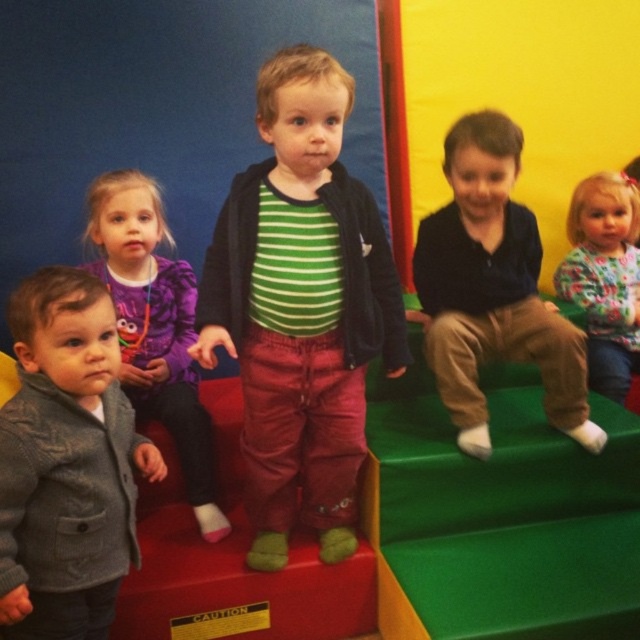
Question: Considering the real-world distances, which object is closest to the floral fabric dress at upper right?

Choices:
 (A) dark blue shirt at upper right
 (B) green striped shirt at center
 (C) knitted gray sweater at left

Answer: (A)

Question: Which of the following is the farthest from the observer?

Choices:
 (A) (556, 330)
 (B) (353, 394)

Answer: (A)

Question: Can you confirm if purple fleece shirt at left is smaller than floral fabric dress at upper right?

Choices:
 (A) no
 (B) yes

Answer: (A)

Question: Is green striped shirt at center in front of knitted gray sweater at left?

Choices:
 (A) yes
 (B) no

Answer: (B)

Question: Is green striped shirt at center closer to camera compared to dark blue shirt at upper right?

Choices:
 (A) no
 (B) yes

Answer: (B)

Question: Among these objects, which one is farthest from the camera?

Choices:
 (A) floral fabric dress at upper right
 (B) purple fleece shirt at left
 (C) dark blue shirt at upper right
 (D) green striped shirt at center

Answer: (A)